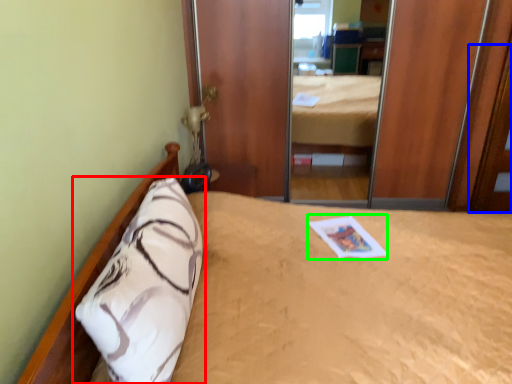
Question: Which is farther away from pillow (highlighted by a red box)? door (highlighted by a blue box) or magazine (highlighted by a green box)?

Choices:
 (A) door
 (B) magazine

Answer: (A)